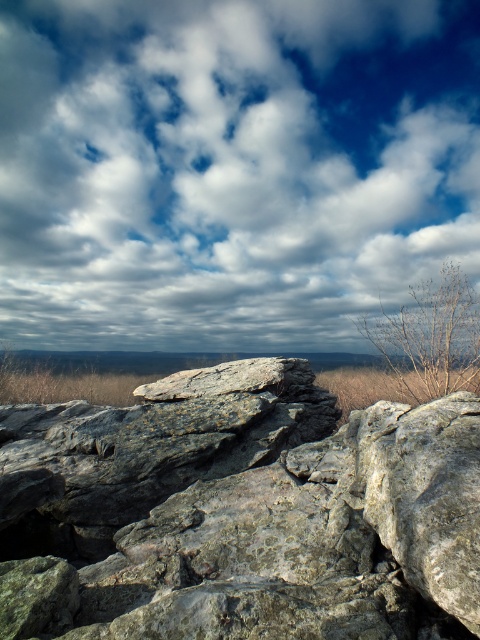
Question: Which object appears farthest from the camera in this image?

Choices:
 (A) gray rock at center
 (B) cloudy sky at upper center
 (C) brown dry weed at upper right
 (D) brown dry grass at right

Answer: (B)

Question: Is cloudy sky at upper center positioned before gray rock at center?

Choices:
 (A) yes
 (B) no

Answer: (B)

Question: Among these objects, which one is farthest from the camera?

Choices:
 (A) gray/rough rock at center
 (B) brown dry weed at upper right

Answer: (B)

Question: Among these points, which one is farthest from the camera?

Choices:
 (A) (274, 218)
 (B) (144, 353)
 (C) (107, 474)

Answer: (A)

Question: Is gray rock at center to the right of brown dry grass at right from the viewer's perspective?

Choices:
 (A) no
 (B) yes

Answer: (A)

Question: Is gray rock at center in front of brown dry grass at right?

Choices:
 (A) yes
 (B) no

Answer: (B)